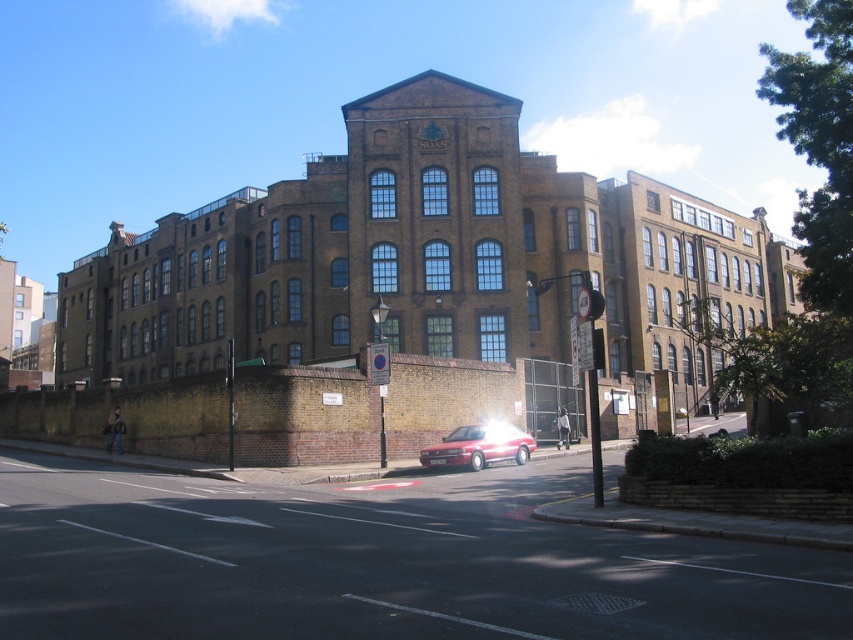
You are a delivery driver who needs to park your vehicle on the black asphalt road at center. The parking space available is exactly the width of the metallic traffic light at center. Can your vehicle fit into this parking space?

The black asphalt road at center has a width larger than the metallic traffic light at center. Since the parking space is only as wide as the traffic light, your vehicle may not fit if it is wider than the traffic light.